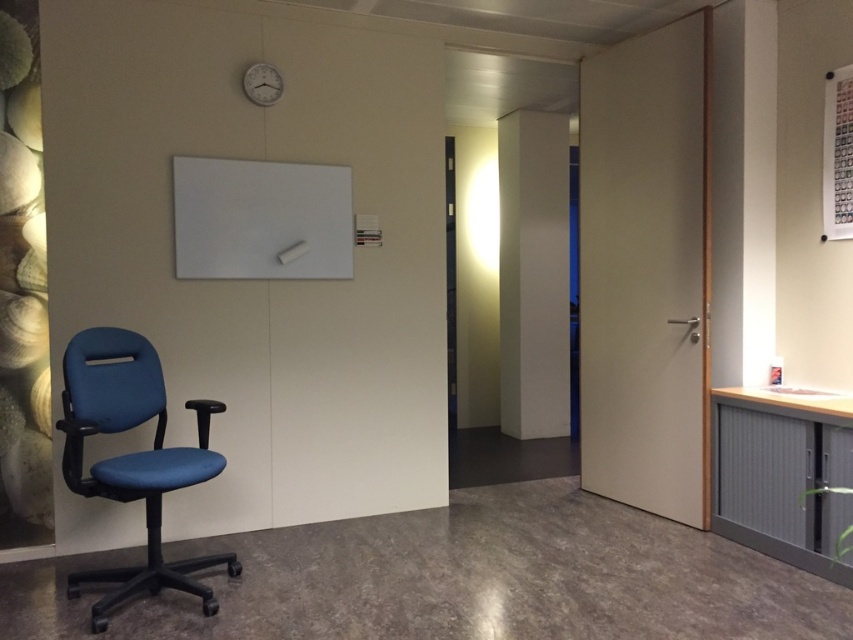
Looking at this image, can you confirm if blue fabric swivel chair at left is positioned to the right of white matte whiteboard at upper center?

In fact, blue fabric swivel chair at left is to the left of white matte whiteboard at upper center.

Measure the distance between point (x=105, y=381) and camera.

3.02 meters

This screenshot has width=853, height=640. I want to click on blue fabric swivel chair at left, so click(132, 456).

From the picture: Can you confirm if white matte whiteboard at upper center is shorter than metallic silver clock at upper center?

Incorrect, white matte whiteboard at upper center's height does not fall short of metallic silver clock at upper center's.

Does point (248, 205) come in front of point (274, 81)?

Yes, it is.

At what (x,y) coordinates should I click in order to perform the action: click on white matte whiteboard at upper center. Please return your answer as a coordinate pair (x, y). The width and height of the screenshot is (853, 640). Looking at the image, I should click on (260, 220).

Is blue fabric swivel chair at left bigger than metallic silver clock at upper center?

Yes.

Who is more distant from viewer, (119, 352) or (270, 100)?

The point (270, 100) is more distant.

Locate an element on the screen. This screenshot has width=853, height=640. blue fabric swivel chair at left is located at coordinates (132, 456).